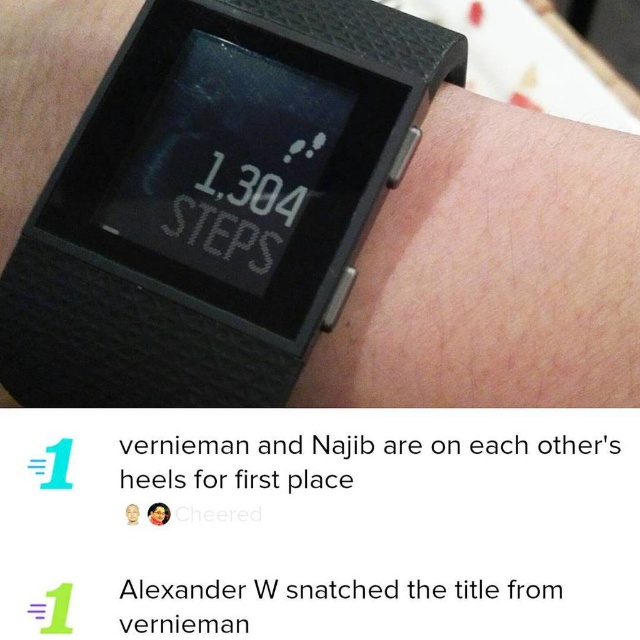
You are a delivery person who needs to deliver a package to a mailbox that is 10 inches wide. The black matte watch at upper center and the matte black watch at upper center are both on the same shelf. Can both watches fit side by side on the shelf without overlapping?

The black matte watch at upper center and the matte black watch at upper center are 7.62 inches apart, so they can fit side by side on the 10 inch wide shelf since 7.62 is less than 10.

You are a photographer trying to capture the black matte watch at upper center and the matte black watch at upper center in a single photo. Which one will appear closer to the camera in the photo?

The black matte watch at upper center will appear closer to the camera because it is in front of the matte black watch at upper center.